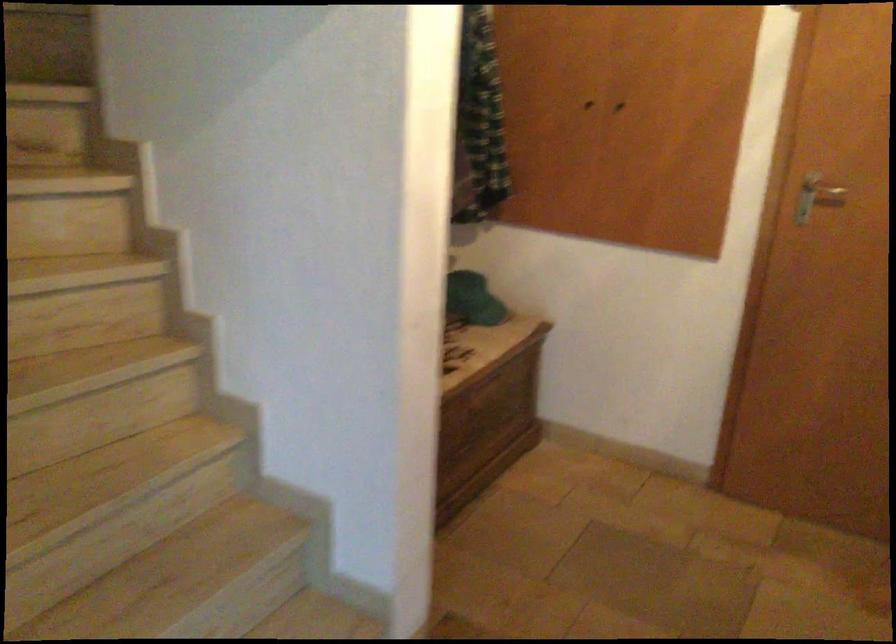
Find the location of a particular element. This screenshot has width=896, height=644. silver door handle is located at coordinates (823, 190).